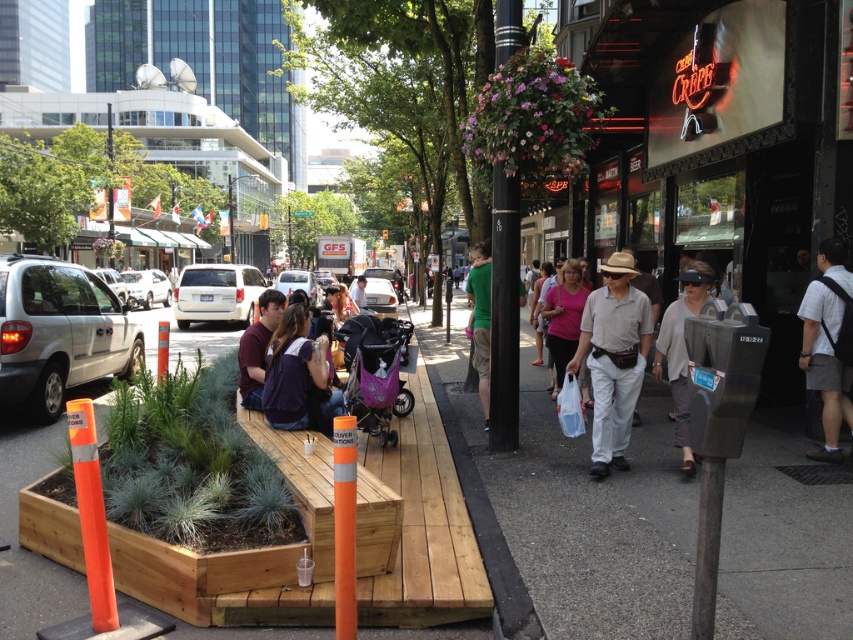
Find the location of a particular element. white cotton shirt at right is located at coordinates (824, 364).

Can you confirm if white cotton shirt at right is bigger than matte maroon shirt at center?

Indeed, white cotton shirt at right has a larger size compared to matte maroon shirt at center.

What do you see at coordinates (824, 364) in the screenshot?
I see `white cotton shirt at right` at bounding box center [824, 364].

Locate an element on the screen. This screenshot has height=640, width=853. white cotton shirt at right is located at coordinates (824, 364).

Can you confirm if pink floral hanging basket at upper center is positioned above purple fabric shirt at center?

Yes.

Does pink floral hanging basket at upper center have a lesser width compared to purple fabric shirt at center?

No, pink floral hanging basket at upper center is not thinner than purple fabric shirt at center.

Is point (573, 154) positioned before point (289, 326)?

No, it is behind (289, 326).

Where is `pink floral hanging basket at upper center`? pink floral hanging basket at upper center is located at coordinates (532, 116).

I want to click on wooden bench at center, so click(16, 534).

Is wooden bench at center positioned at the back of white cotton shirt at right?

No, it is in front of white cotton shirt at right.

Between point (20, 614) and point (830, 378), which one is positioned in front?

Point (20, 614) is more forward.

Where is `wooden bench at center`? This screenshot has height=640, width=853. wooden bench at center is located at coordinates 16,534.